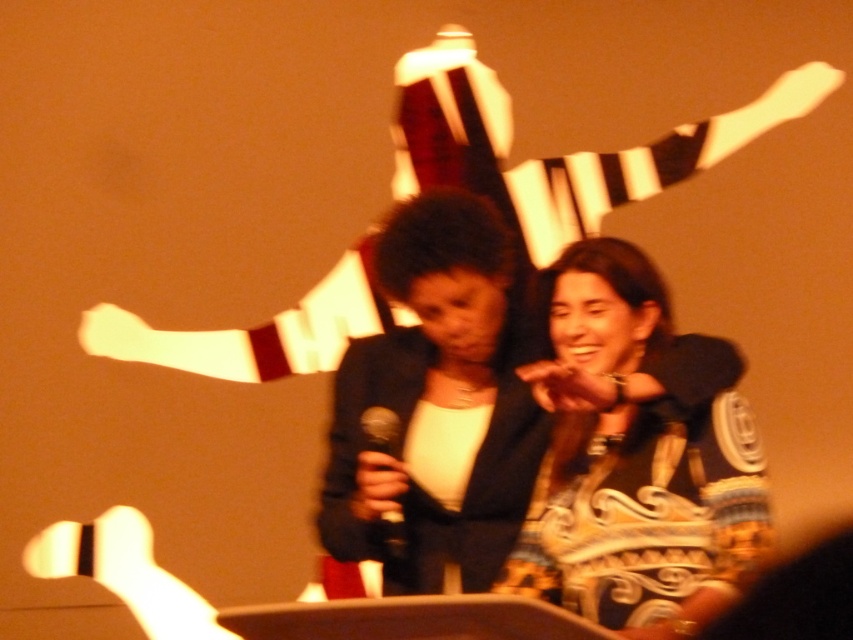
Question: Considering the real-world distances, which object is closest to the black matte microphone at center?

Choices:
 (A) matte black blazer at center
 (B) matte black jacket at center

Answer: (A)

Question: Which point is closer to the camera?

Choices:
 (A) (607, 248)
 (B) (422, 252)
 (C) (383, 410)

Answer: (A)

Question: Can you confirm if matte black blazer at center is positioned below black matte microphone at center?

Choices:
 (A) no
 (B) yes

Answer: (A)

Question: Is the position of matte black blazer at center less distant than that of black matte microphone at center?

Choices:
 (A) yes
 (B) no

Answer: (A)

Question: Is matte black jacket at center wider than black matte microphone at center?

Choices:
 (A) yes
 (B) no

Answer: (A)

Question: Which point is closer to the camera?

Choices:
 (A) (357, 436)
 (B) (769, 513)
 (C) (399, 422)

Answer: (B)